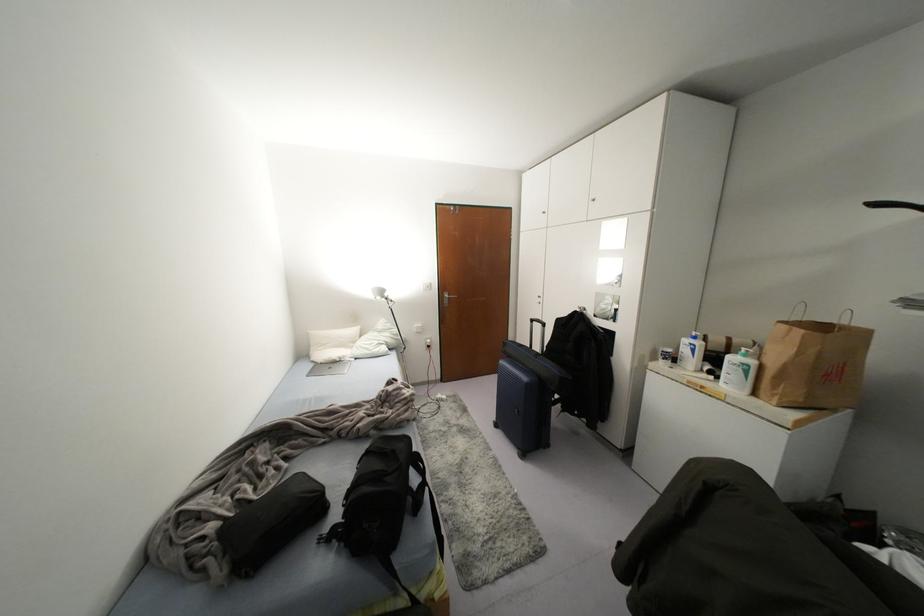
Find where to lift the paper bag handle. Please return your answer as a coordinate pair (x, y).

(797, 310)